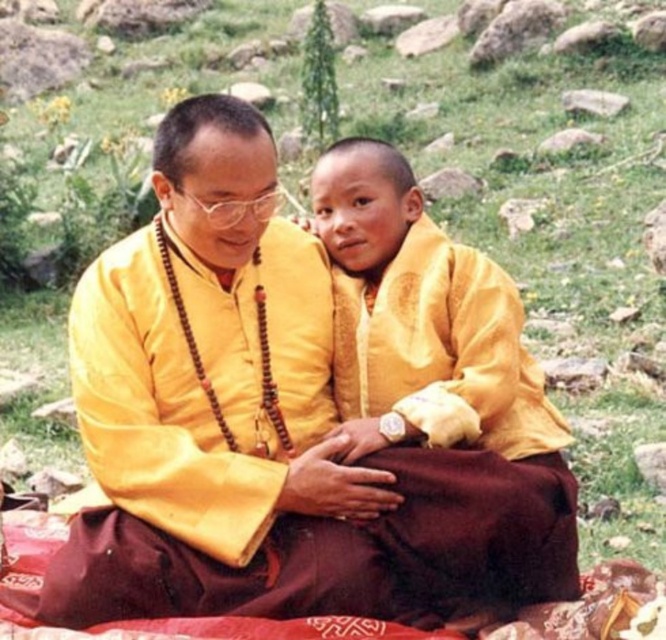
Question: Can you confirm if yellow silk robe at center is thinner than yellow matte/yellow fabric at center?

Choices:
 (A) no
 (B) yes

Answer: (A)

Question: Is yellow silk robe at center smaller than yellow matte/yellow fabric at center?

Choices:
 (A) no
 (B) yes

Answer: (A)

Question: Among these points, which one is farthest from the camera?

Choices:
 (A) (153, 465)
 (B) (398, 312)

Answer: (B)

Question: Does yellow silk robe at center appear on the right side of yellow matte/yellow fabric at center?

Choices:
 (A) no
 (B) yes

Answer: (A)